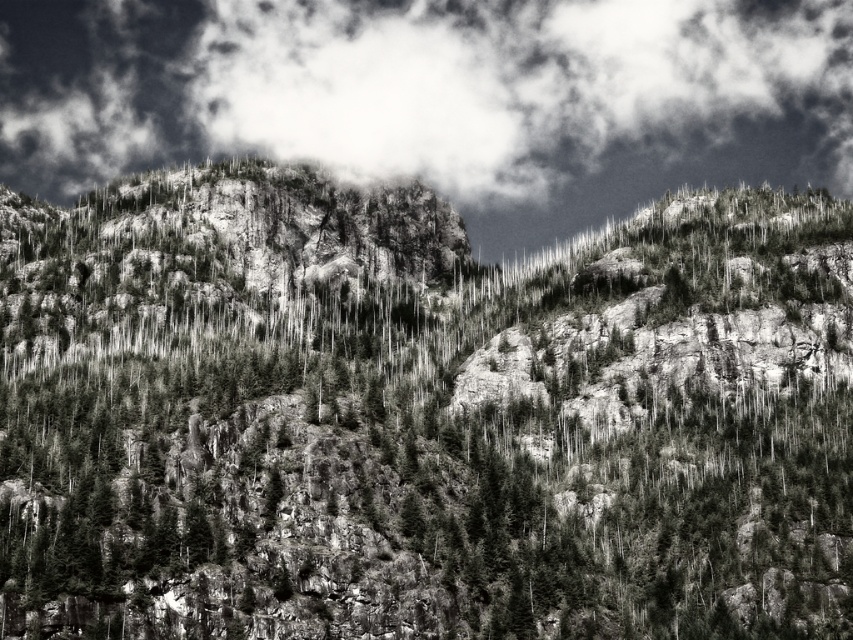
Question: Is dark gray textured rock at center to the right of white fluffy cloud at upper center from the viewer's perspective?

Choices:
 (A) yes
 (B) no

Answer: (B)

Question: From the image, what is the correct spatial relationship of dark gray textured rock at center in relation to white fluffy cloud at upper center?

Choices:
 (A) left
 (B) right

Answer: (A)

Question: Among these points, which one is farthest from the camera?

Choices:
 (A) (645, 408)
 (B) (302, 97)

Answer: (B)

Question: Which of the following is the farthest from the observer?

Choices:
 (A) (117, 189)
 (B) (479, 13)

Answer: (B)

Question: Can you confirm if dark gray textured rock at center is positioned below white fluffy cloud at upper center?

Choices:
 (A) yes
 (B) no

Answer: (A)

Question: Which point is farther to the camera?

Choices:
 (A) (57, 118)
 (B) (526, 561)

Answer: (A)